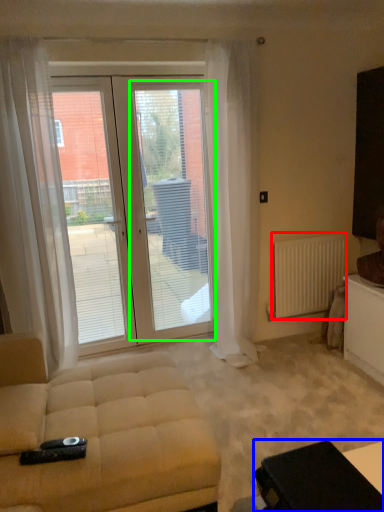
Question: Estimate the real-world distances between objects in this image. Which object is closer to radiator (highlighted by a red box), table (highlighted by a blue box) or screen door (highlighted by a green box)?

Choices:
 (A) table
 (B) screen door

Answer: (B)